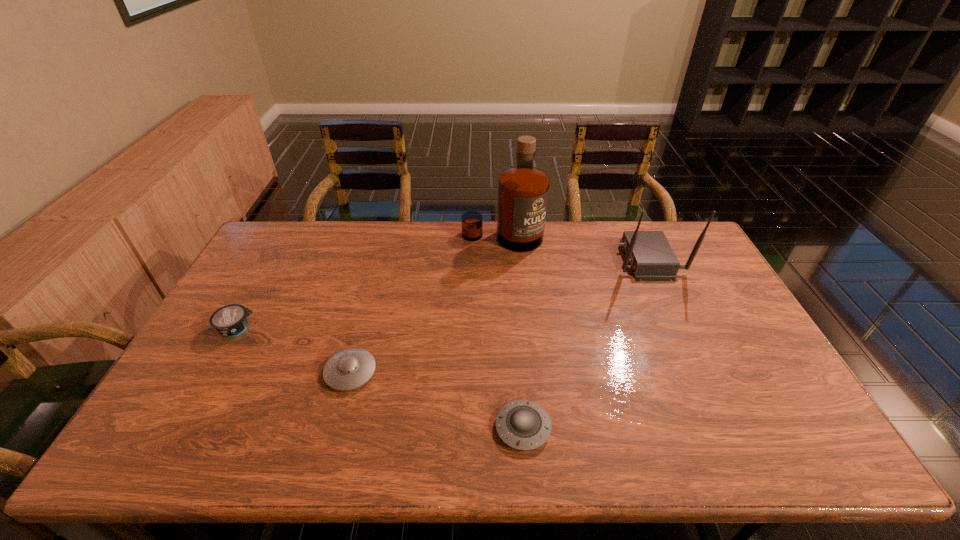
The height and width of the screenshot is (540, 960). I want to click on vacant space that satisfies the following two spatial constraints: 1. on the front label of the nearer saucer; 2. on the left side of the tallest object, so click(x=515, y=428).